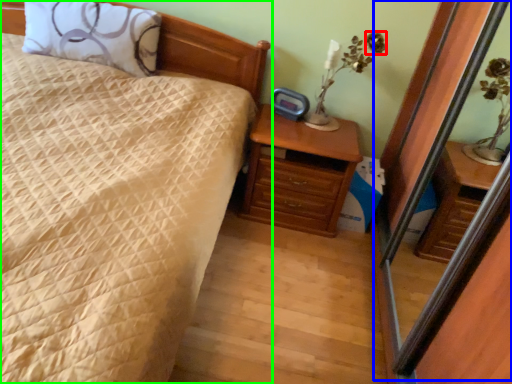
Question: Considering the real-world distances, which object is closest to flower (highlighted by a red box)? screen door (highlighted by a blue box) or bed (highlighted by a green box).

Choices:
 (A) screen door
 (B) bed

Answer: (A)